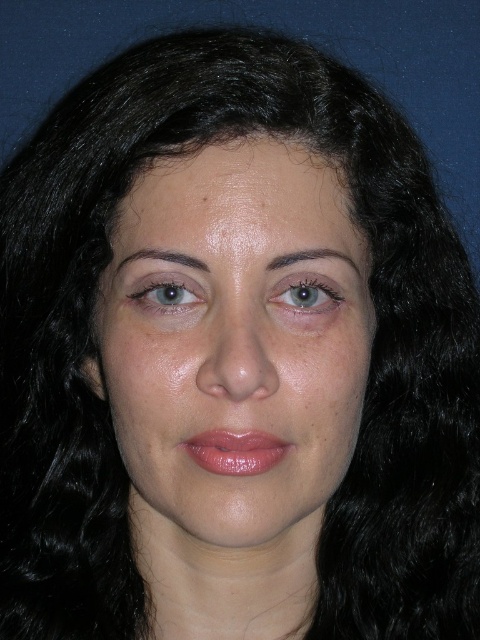
Does smooth skin face at center come in front of matte skin eye at upper left?

Yes, it is in front of matte skin eye at upper left.

Which is in front, point (355, 352) or point (192, 282)?

Positioned in front is point (192, 282).

I want to click on smooth skin face at center, so click(x=233, y=348).

Is the position of smooth skin face at center more distant than that of light brown eye at center?

No, it is not.

Is smooth skin face at center bigger than light brown eye at center?

Yes.

At what (x,y) coordinates should I click in order to perform the action: click on smooth skin face at center. Please return your answer as a coordinate pair (x, y). This screenshot has height=640, width=480. Looking at the image, I should click on (x=233, y=348).

Identify the location of smooth skin face at center. The image size is (480, 640). (233, 348).

Is point (296, 291) less distant than point (190, 301)?

No.

Does light brown eye at center lie in front of matte skin eye at upper left?

No, it is behind matte skin eye at upper left.

In order to click on light brown eye at center in this screenshot , I will do `click(305, 292)`.

The image size is (480, 640). What are the coordinates of `light brown eye at center` in the screenshot? It's located at (305, 292).